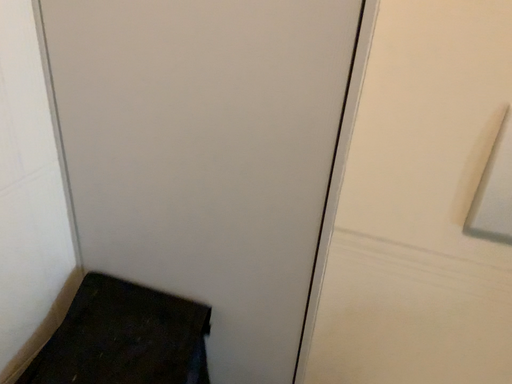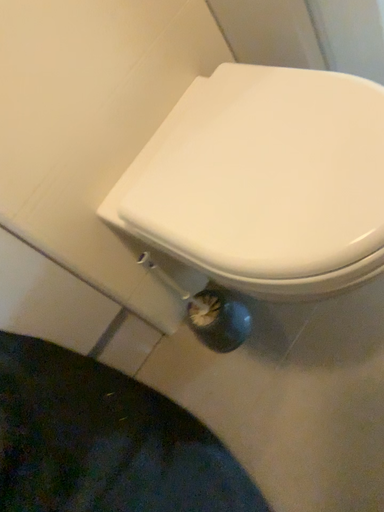
Question: How did the camera likely rotate when shooting the video?

Choices:
 (A) rotated right
 (B) rotated left

Answer: (A)